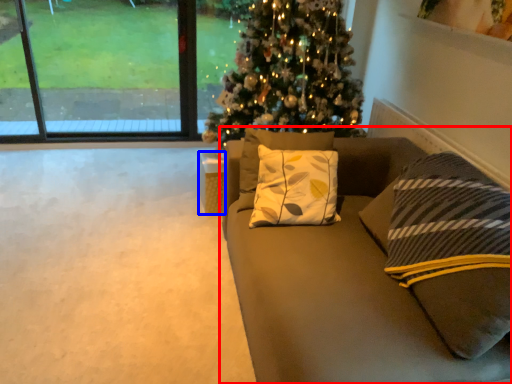
Question: Which of the following is the closest to the observer, studio couch (highlighted by a red box) or furniture (highlighted by a blue box)?

Choices:
 (A) studio couch
 (B) furniture

Answer: (A)